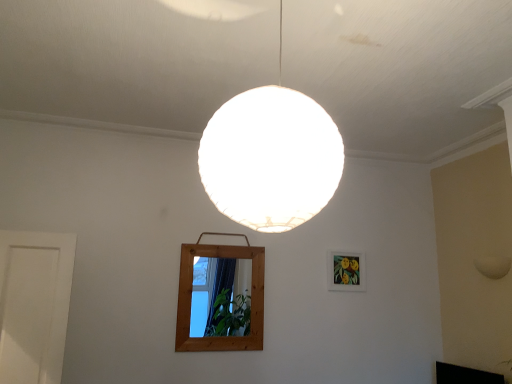
Question: Is matte wooden picture frame at upper right touching white matte sphere at center?

Choices:
 (A) no
 (B) yes

Answer: (A)

Question: Can you confirm if matte wooden picture frame at upper right is positioned to the left of white matte sphere at center?

Choices:
 (A) yes
 (B) no

Answer: (B)

Question: Is matte wooden picture frame at upper right outside of white matte sphere at center?

Choices:
 (A) yes
 (B) no

Answer: (A)

Question: Are matte wooden picture frame at upper right and white matte sphere at center far apart?

Choices:
 (A) no
 (B) yes

Answer: (B)

Question: From a real-world perspective, is matte wooden picture frame at upper right over white matte sphere at center?

Choices:
 (A) no
 (B) yes

Answer: (A)

Question: Considering the positions of white matte sphere at center and matte wooden picture frame at upper right in the image, is white matte sphere at center bigger or smaller than matte wooden picture frame at upper right?

Choices:
 (A) big
 (B) small

Answer: (A)

Question: Is white matte sphere at center inside the boundaries of matte wooden picture frame at upper right, or outside?

Choices:
 (A) outside
 (B) inside

Answer: (A)

Question: Is white matte sphere at center taller or shorter than matte wooden picture frame at upper right?

Choices:
 (A) tall
 (B) short

Answer: (A)

Question: From the image's perspective, is white matte sphere at center positioned above or below matte wooden picture frame at upper right?

Choices:
 (A) above
 (B) below

Answer: (A)

Question: From a real-world perspective, relative to black glossy tv at lower right, is white matte sphere at center vertically above or below?

Choices:
 (A) below
 (B) above

Answer: (B)

Question: Looking at the image, does white matte sphere at center seem bigger or smaller compared to black glossy tv at lower right?

Choices:
 (A) small
 (B) big

Answer: (B)

Question: Does point (293, 99) appear closer or farther from the camera than point (459, 374)?

Choices:
 (A) farther
 (B) closer

Answer: (B)

Question: Is white matte sphere at center situated inside black glossy tv at lower right or outside?

Choices:
 (A) inside
 (B) outside

Answer: (B)

Question: Is point 347,253 positioned closer to the camera than point 226,168?

Choices:
 (A) closer
 (B) farther

Answer: (B)

Question: In terms of size, does matte wooden picture frame at upper right appear bigger or smaller than white matte sphere at center?

Choices:
 (A) small
 (B) big

Answer: (A)